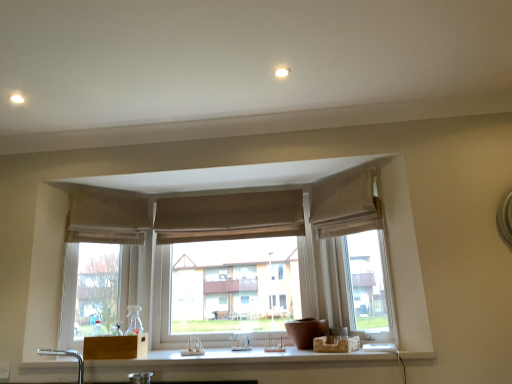
In order to click on empty space that is ontop of beige fabric curtain at upper right, which ranks as the 1th curtain in right-to-left order (from a real-world perspective) in this screenshot , I will do `click(337, 176)`.